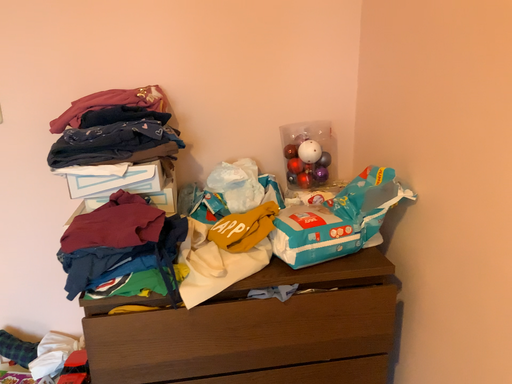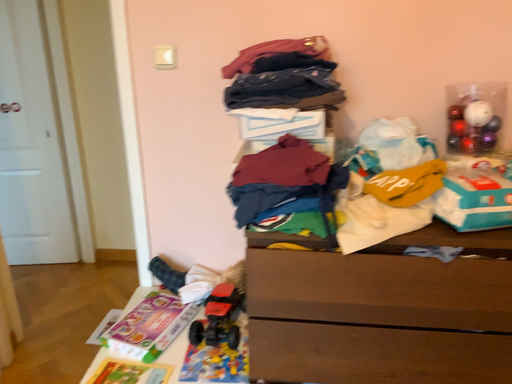
Question: Which way did the camera rotate in the video?

Choices:
 (A) rotated left
 (B) rotated right

Answer: (A)